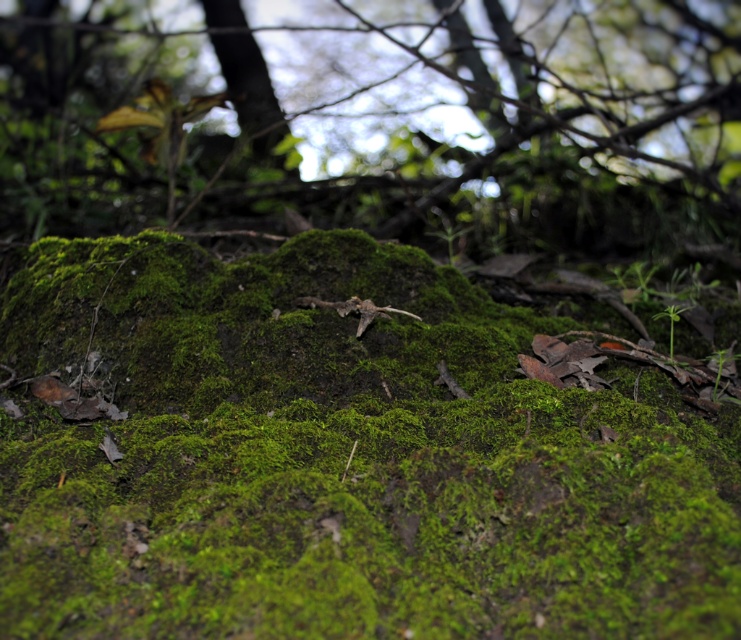
Question: Can you confirm if green mossy rock at center is thinner than smooth brown tree trunk at upper center?

Choices:
 (A) no
 (B) yes

Answer: (A)

Question: Is green mossy rock at center positioned before smooth brown tree trunk at upper center?

Choices:
 (A) yes
 (B) no

Answer: (A)

Question: Among these points, which one is farthest from the camera?

Choices:
 (A) (245, 273)
 (B) (242, 10)

Answer: (B)

Question: Which point is farther to the camera?

Choices:
 (A) smooth brown tree trunk at upper center
 (B) green fuzzy moss at center

Answer: (A)

Question: Among these points, which one is farthest from the camera?

Choices:
 (A) (247, 77)
 (B) (458, 522)

Answer: (A)

Question: Can you confirm if green fuzzy moss at center is positioned to the left of green mossy rock at center?

Choices:
 (A) yes
 (B) no

Answer: (B)